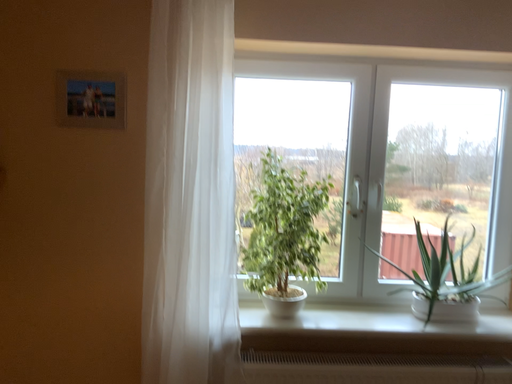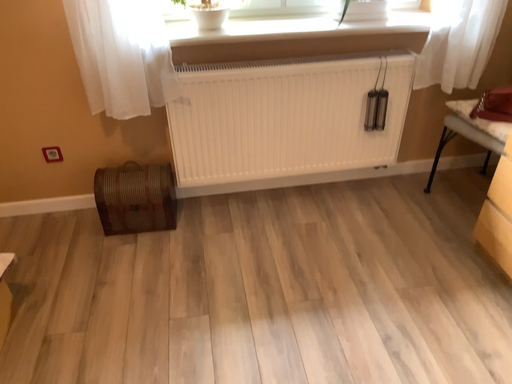
Question: How did the camera likely rotate when shooting the video?

Choices:
 (A) rotated left
 (B) rotated right

Answer: (B)